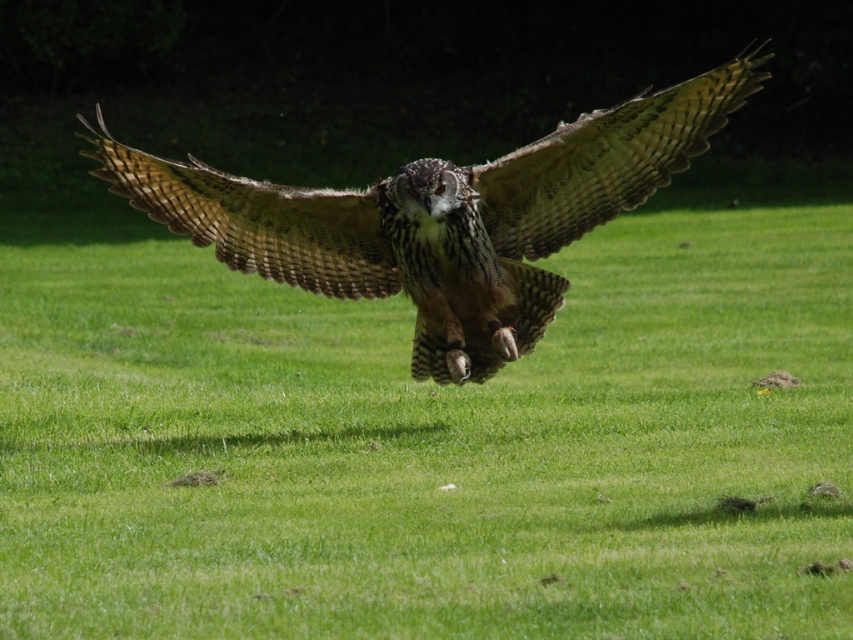
You are an ornithologist observing the scene. You notice the green grassy field at center and the brown feathered eagle at center. Which object is closer to the observer?

The green grassy field at center is closer to the observer than the brown feathered eagle at center because it is positioned in front of it.